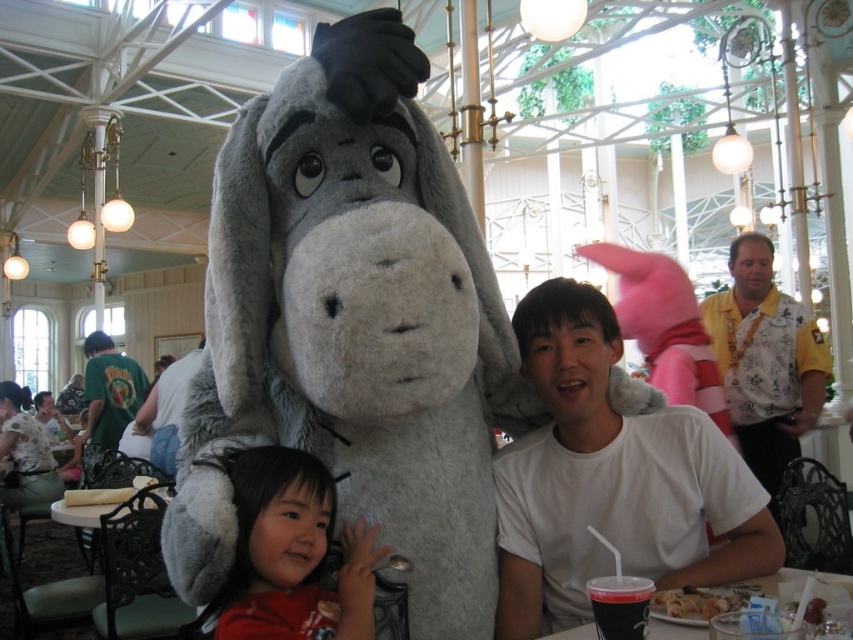
Question: Is white cotton shirt at center in front of green t-shirt at left?

Choices:
 (A) no
 (B) yes

Answer: (B)

Question: Among these points, which one is farthest from the camera?

Choices:
 (A) (113, 358)
 (B) (703, 628)

Answer: (A)

Question: Is smooth red shirt at lower left smaller than yellow printed shirt at right?

Choices:
 (A) yes
 (B) no

Answer: (A)

Question: Which object is the closest to the black plastic cup at lower right?

Choices:
 (A) smooth red shirt at lower left
 (B) fluffy gray plush at center
 (C) white cotton shirt at center
 (D) green t-shirt at left

Answer: (C)

Question: Is white cotton shirt at center closer to the viewer compared to white t-shirt at center?

Choices:
 (A) yes
 (B) no

Answer: (A)

Question: Which object is closer to the camera taking this photo?

Choices:
 (A) white t-shirt at center
 (B) yellow printed shirt at right
 (C) fluffy gray plush at center
 (D) black plastic cup at lower right

Answer: (C)